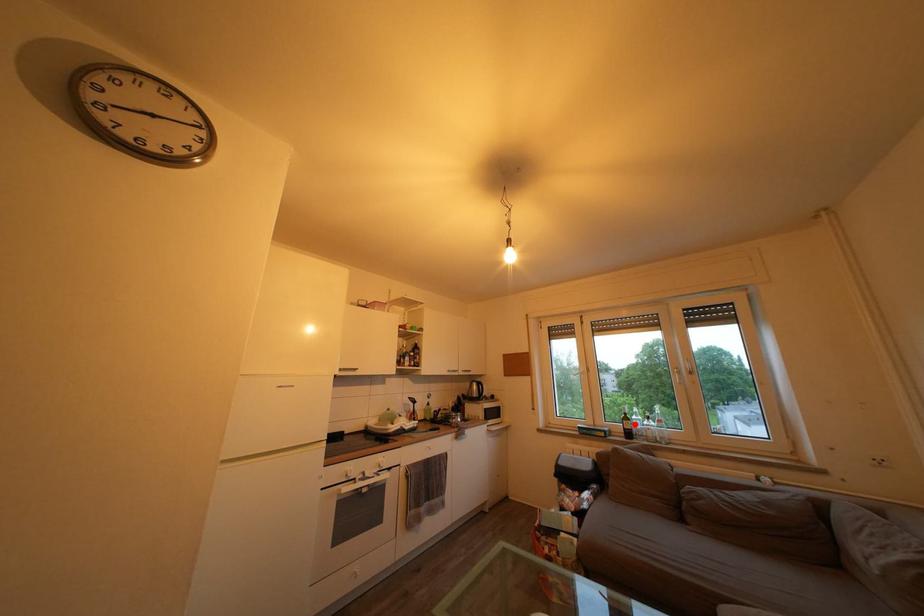
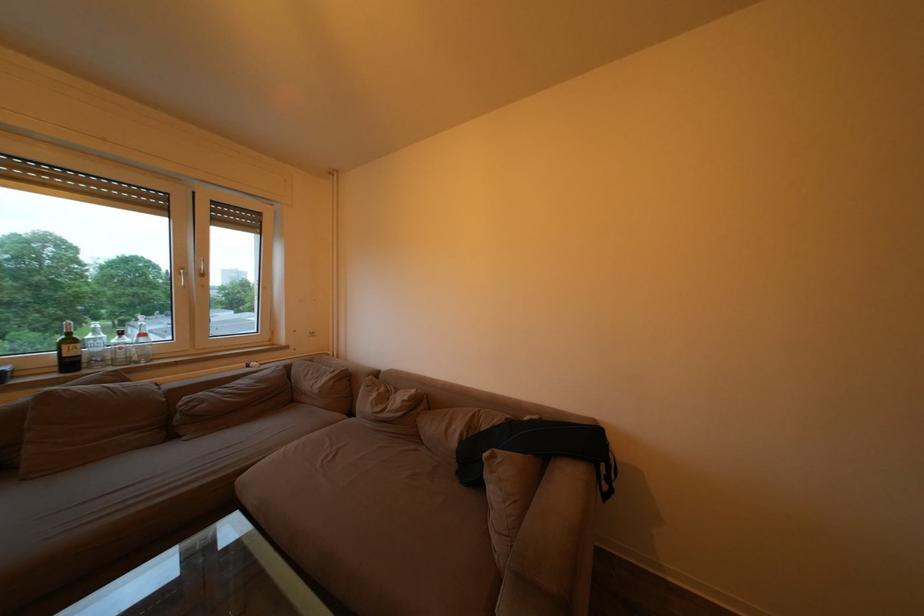
Question: A red point is marked in image1. In image2, is the corresponding 3D point closer to the camera or farther? Reply with the corresponding letter.

Choices:
 (A) The corresponding 3D point is closer.
 (B) The corresponding 3D point is farther.

Answer: (A)